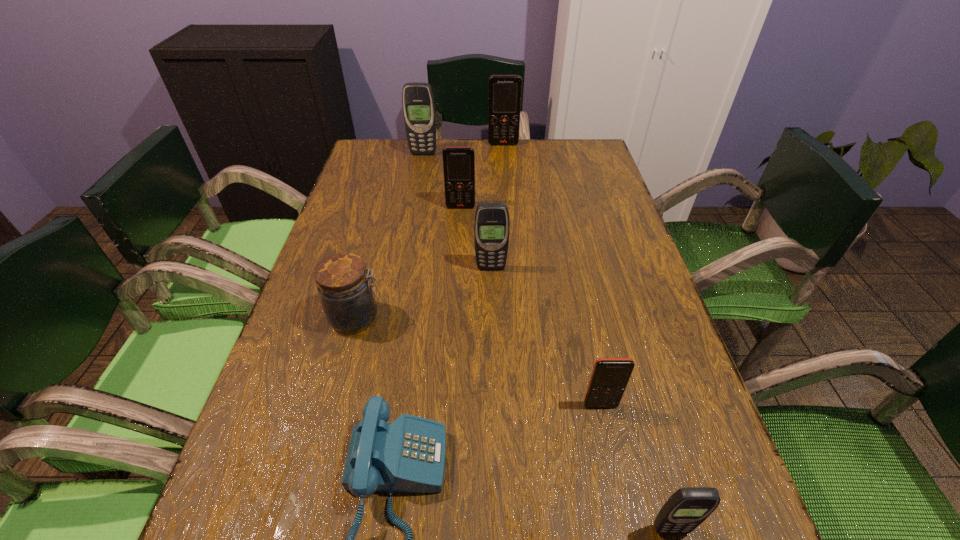
Where is `the farthest orange cellular telephone`? the farthest orange cellular telephone is located at coordinates (505, 91).

Image resolution: width=960 pixels, height=540 pixels. Find the location of `the farthest cellular telephone`. the farthest cellular telephone is located at coordinates (505, 91).

Where is `the seventh nearest object`? The height and width of the screenshot is (540, 960). the seventh nearest object is located at coordinates (418, 103).

The width and height of the screenshot is (960, 540). What are the coordinates of `the farthest gray cellular telephone` in the screenshot? It's located at (418, 103).

Where is `the second farthest gray cellular telephone`? The image size is (960, 540). the second farthest gray cellular telephone is located at coordinates (492, 224).

Find the location of a particular element. the fourth farthest object is located at coordinates (492, 224).

The height and width of the screenshot is (540, 960). I want to click on the sixth nearest object, so click(x=458, y=162).

Identify the location of the second farthest orange cellular telephone. (458, 162).

Locate an element on the screen. This screenshot has width=960, height=540. the fourth nearest object is located at coordinates (348, 300).

The width and height of the screenshot is (960, 540). I want to click on the second nearest cellular telephone, so click(x=610, y=376).